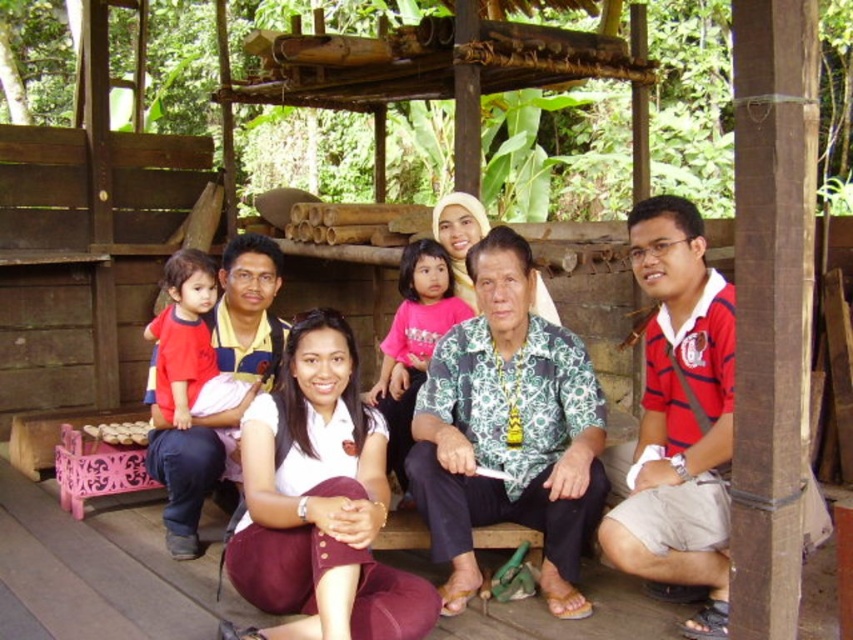
Question: Which point appears farthest from the camera in this image?

Choices:
 (A) (379, 444)
 (B) (532, 317)
 (C) (397, 404)
 (D) (252, 333)

Answer: (D)

Question: Does white matte shirt at center have a larger size compared to red cotton shirt at left?

Choices:
 (A) no
 (B) yes

Answer: (B)

Question: Which object appears closest to the camera in this image?

Choices:
 (A) pink fabric shirt at center
 (B) white matte shirt at center
 (C) white shirt at center

Answer: (B)

Question: Does white matte shirt at center come in front of pink fabric shirt at center?

Choices:
 (A) no
 (B) yes

Answer: (B)

Question: Is white matte shirt at center to the left of red cotton shirt at left from the viewer's perspective?

Choices:
 (A) no
 (B) yes

Answer: (A)

Question: Which object is farther from the camera taking this photo?

Choices:
 (A) white shirt at center
 (B) red cotton shirt at left
 (C) white matte shirt at center

Answer: (B)